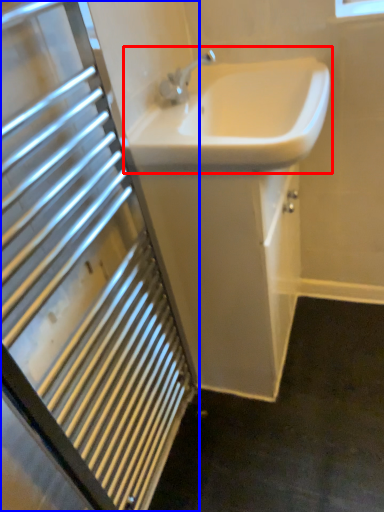
Question: Among these objects, which one is nearest to the camera, sink (highlighted by a red box) or bathroom cabinet (highlighted by a blue box)?

Choices:
 (A) sink
 (B) bathroom cabinet

Answer: (B)